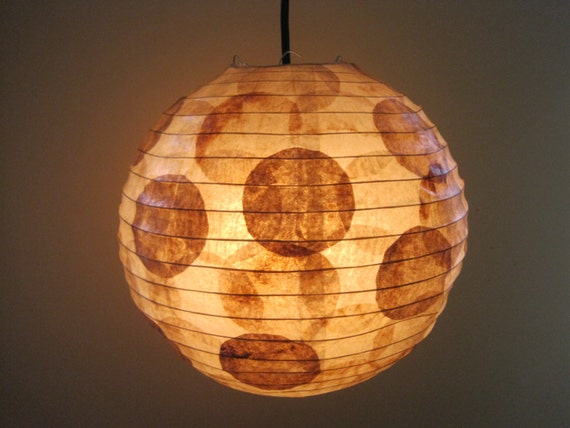
Where is `paper lamp`? The image size is (570, 428). paper lamp is located at coordinates (317, 221).